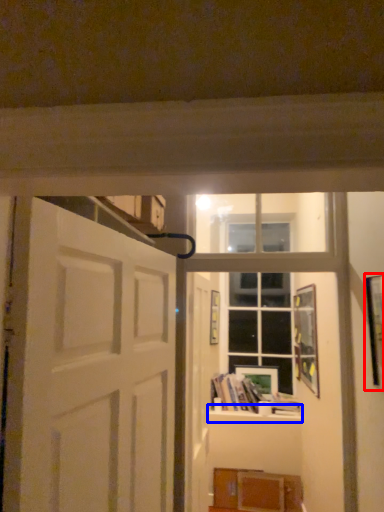
Question: Which object appears farthest to the camera in this image, picture frame (highlighted by a red box) or window sill (highlighted by a blue box)?

Choices:
 (A) picture frame
 (B) window sill

Answer: (B)